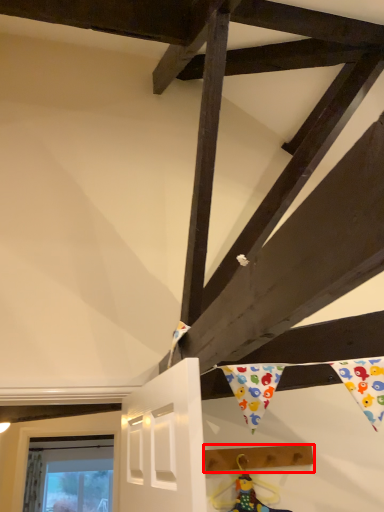
Question: From the image's perspective, where is plank (annotated by the red box) located in relation to doll in the image?

Choices:
 (A) above
 (B) below

Answer: (A)